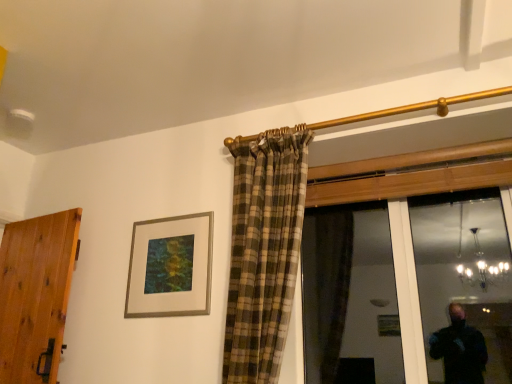
Identify the location of wooden door at left. The width and height of the screenshot is (512, 384). (36, 295).

What do you see at coordinates (36, 295) in the screenshot? This screenshot has height=384, width=512. I see `wooden door at left` at bounding box center [36, 295].

What do you see at coordinates (170, 267) in the screenshot? The width and height of the screenshot is (512, 384). I see `silver metallic picture frame at upper center` at bounding box center [170, 267].

Locate an element on the screen. This screenshot has height=384, width=512. silver metallic picture frame at upper center is located at coordinates 170,267.

In order to face silver metallic picture frame at upper center, should I rotate leftwards or rightwards?

Rotate your view left by about 11.708°.

This screenshot has width=512, height=384. Identify the location of wooden door at left. (36, 295).

Is silver metallic picture frame at upper center to the left or to the right of wooden door at left in the image?

silver metallic picture frame at upper center is positioned on wooden door at left's right side.

Who is more distant, silver metallic picture frame at upper center or wooden door at left?

silver metallic picture frame at upper center is more distant.

Does point (157, 223) appear closer or farther from the camera than point (16, 331)?

Point (157, 223) is positioned farther from the camera compared to point (16, 331).

From the image's perspective, would you say silver metallic picture frame at upper center is shown under wooden door at left?

Incorrect, from the image's perspective, silver metallic picture frame at upper center is higher than wooden door at left.

In the scene shown: From a real-world perspective, between silver metallic picture frame at upper center and wooden door at left, who is vertically higher?

silver metallic picture frame at upper center, from a real-world perspective.

Which of these two, silver metallic picture frame at upper center or wooden door at left, is wider?

With larger width is wooden door at left.

Who is taller, silver metallic picture frame at upper center or wooden door at left?

Standing taller between the two is wooden door at left.

Considering the relative sizes of silver metallic picture frame at upper center and wooden door at left in the image provided, is silver metallic picture frame at upper center bigger than wooden door at left?

Actually, silver metallic picture frame at upper center might be smaller than wooden door at left.

Would you say silver metallic picture frame at upper center is inside or outside wooden door at left?

The correct answer is: outside.

Are silver metallic picture frame at upper center and wooden door at left beside each other?

silver metallic picture frame at upper center is not next to wooden door at left, and they're not touching.

Is silver metallic picture frame at upper center aimed at wooden door at left?

No, silver metallic picture frame at upper center is not turned towards wooden door at left.

Can you tell me how much silver metallic picture frame at upper center and wooden door at left differ in facing direction?

7.55 degrees.

How much distance is there between silver metallic picture frame at upper center and wooden door at left?

silver metallic picture frame at upper center is 59.68 centimeters from wooden door at left.

Locate an element on the screen. The height and width of the screenshot is (384, 512). picture frame behind the wooden door at left is located at coordinates (170, 267).

Which object is positioned more to the right, wooden door at left or silver metallic picture frame at upper center?

silver metallic picture frame at upper center is more to the right.

Between wooden door at left and silver metallic picture frame at upper center, which one is positioned in front?

wooden door at left.

Is point (54, 293) closer to viewer compared to point (137, 273)?

Yes.

From the image's perspective, which one is positioned higher, wooden door at left or silver metallic picture frame at upper center?

silver metallic picture frame at upper center, from the image's perspective.

Consider the image. From a real-world perspective, who is located higher, wooden door at left or silver metallic picture frame at upper center?

silver metallic picture frame at upper center, from a real-world perspective.

Between wooden door at left and silver metallic picture frame at upper center, which one has larger width?

wooden door at left is wider.

Between wooden door at left and silver metallic picture frame at upper center, which one has less height?

silver metallic picture frame at upper center is shorter.

Does wooden door at left have a larger size compared to silver metallic picture frame at upper center?

Yes.

Is wooden door at left completely or partially outside of silver metallic picture frame at upper center?

wooden door at left lies outside silver metallic picture frame at upper center's area.

Is wooden door at left not near silver metallic picture frame at upper center?

wooden door at left is near silver metallic picture frame at upper center, not far away.

Does wooden door at left turn towards silver metallic picture frame at upper center?

No, wooden door at left is not oriented towards silver metallic picture frame at upper center.

The width and height of the screenshot is (512, 384). Identify the location of door that is in front of the silver metallic picture frame at upper center. (36, 295).

I want to click on door that appears in front of the silver metallic picture frame at upper center, so click(x=36, y=295).

Find the location of a particular element. door on the left of silver metallic picture frame at upper center is located at coordinates (36, 295).